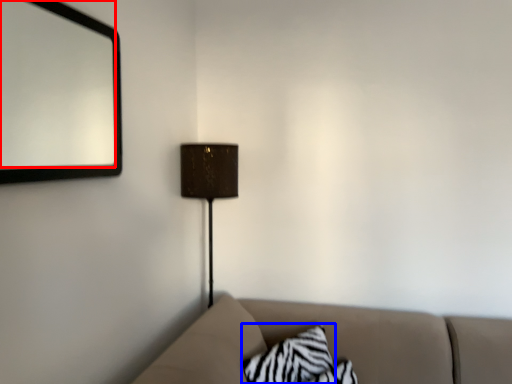
Question: Among these objects, which one is farthest to the camera, mirror (highlighted by a red box) or pillow (highlighted by a blue box)?

Choices:
 (A) mirror
 (B) pillow

Answer: (B)